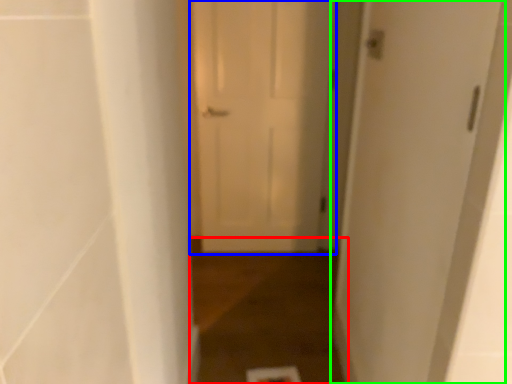
Question: Based on their relative distances, which object is nearer to path (highlighted by a red box)? Choose from door (highlighted by a blue box) and door (highlighted by a green box).

Choices:
 (A) door
 (B) door

Answer: (A)